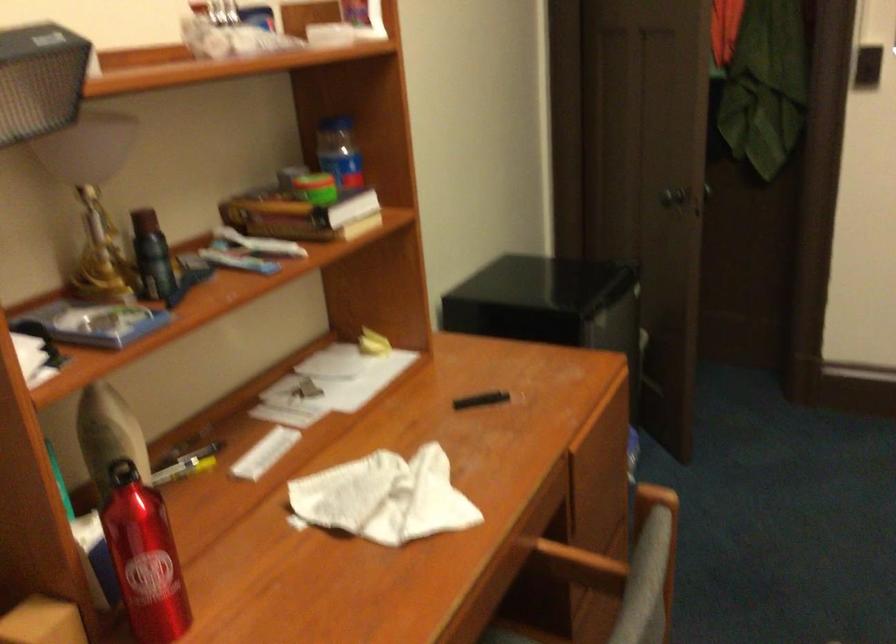
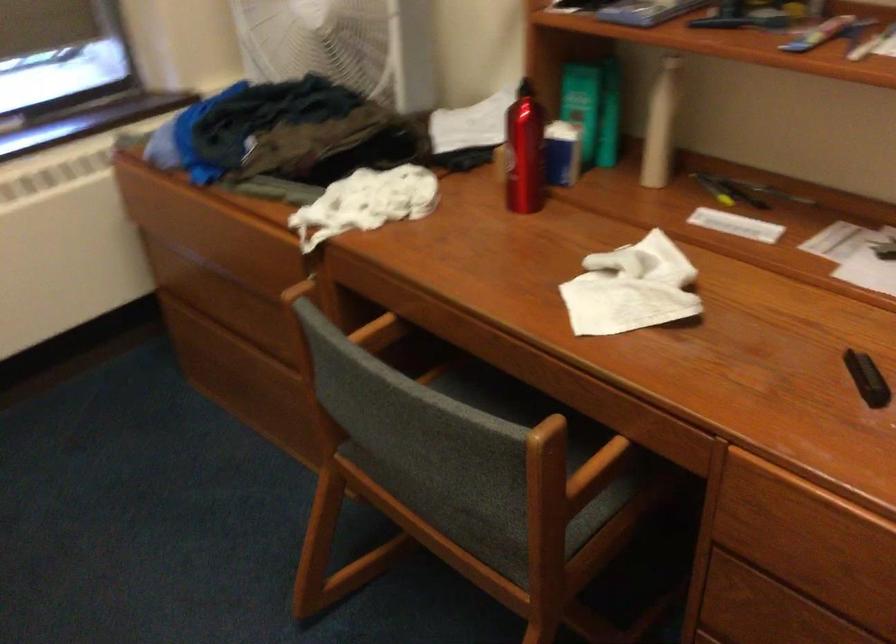
Where in the second image is the point corresponding to point (174, 547) from the first image?

(524, 152)